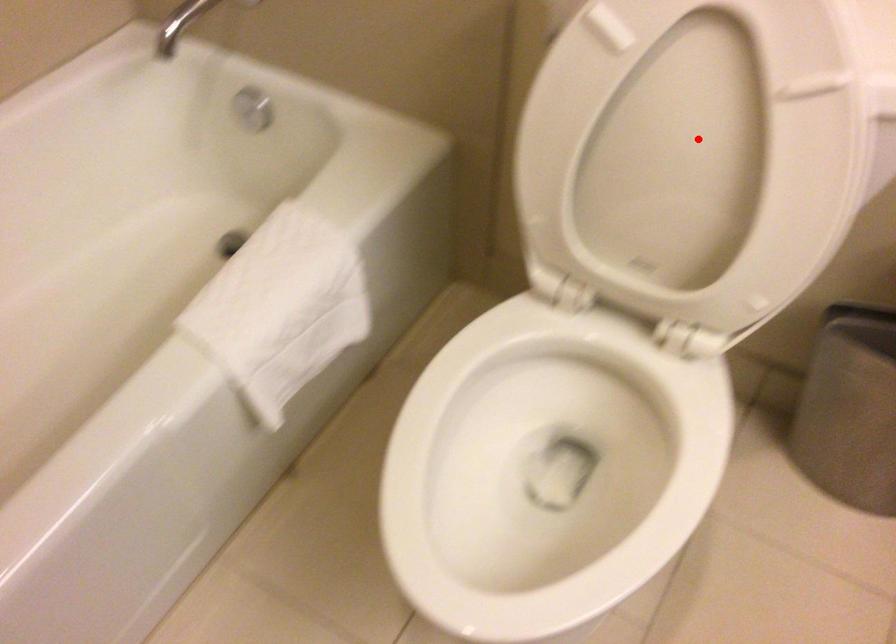
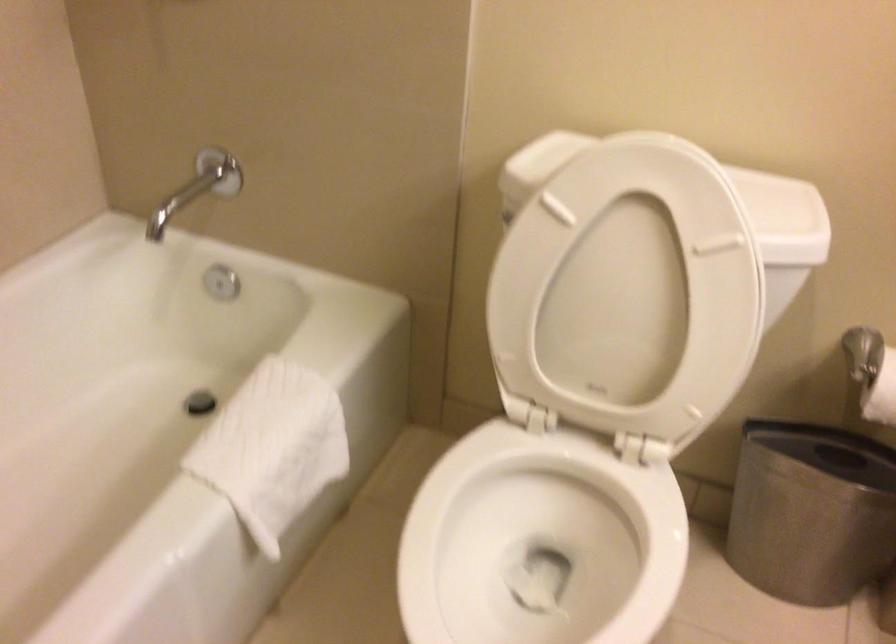
Where in the second image is the point corresponding to the highlighted location from the first image?

(633, 285)